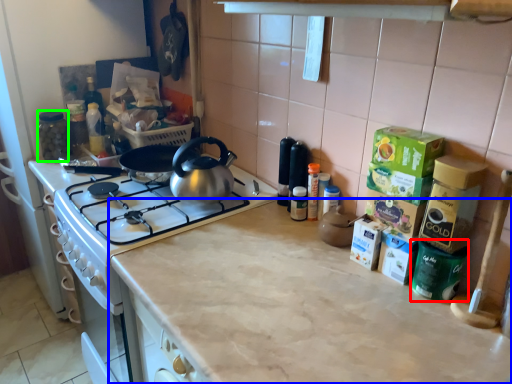
Question: Which is farther away from appliance (highlighted by a red box)? countertop (highlighted by a blue box) or appliance (highlighted by a green box)?

Choices:
 (A) countertop
 (B) appliance

Answer: (B)